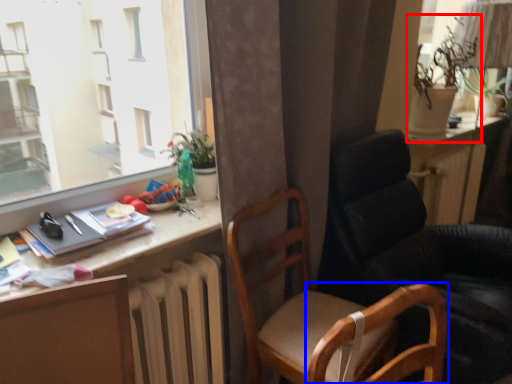
Question: Among these objects, which one is nearest to the camera, houseplant (highlighted by a red box) or swivel chair (highlighted by a blue box)?

Choices:
 (A) houseplant
 (B) swivel chair

Answer: (B)